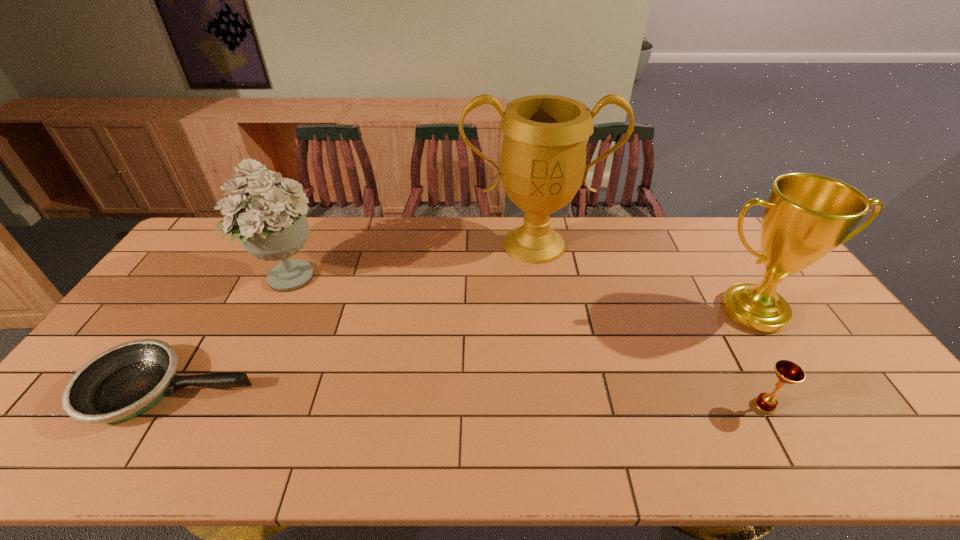
The height and width of the screenshot is (540, 960). I want to click on trophy, so click(x=543, y=159).

This screenshot has width=960, height=540. I want to click on the tallest object, so click(x=543, y=159).

The image size is (960, 540). What are the coordinates of `award` in the screenshot? It's located at (806, 216).

Where is `bouquet`? This screenshot has width=960, height=540. bouquet is located at coordinates (272, 225).

Locate an element on the screen. The width and height of the screenshot is (960, 540). chalice is located at coordinates (788, 372).

Find the location of `frying pan`. frying pan is located at coordinates (125, 381).

Find the location of `vacant space positioned on the engravings side of the third object from left to right`. vacant space positioned on the engravings side of the third object from left to right is located at coordinates (552, 360).

Where is `free space located 0.150m by the handles of the award`? Image resolution: width=960 pixels, height=540 pixels. free space located 0.150m by the handles of the award is located at coordinates (798, 382).

At what (x,y) coordinates should I click in order to perform the action: click on vacant space located on the left of the bouquet. Please return your answer as a coordinate pair (x, y). Looking at the image, I should click on (233, 278).

You are a GUI agent. You are given a task and a screenshot of the screen. Output one action in this format:
    pyautogui.click(x=<x>, y=<y>)
    Task: Click on the vacant space located 0.310m on the left of the second shortest object
    The width and height of the screenshot is (960, 540).
    Given the screenshot: What is the action you would take?
    pyautogui.click(x=626, y=406)